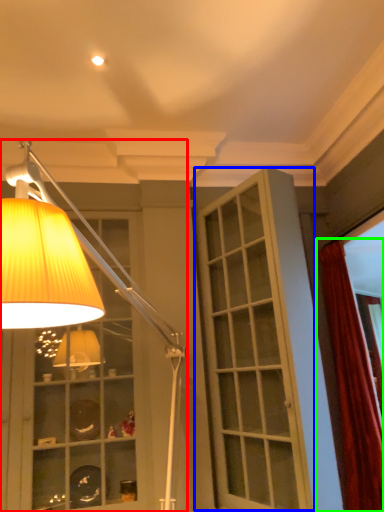
Question: Which object is the farthest from lamp (highlighted by a red box)? Choose among these: screen door (highlighted by a blue box) or curtain (highlighted by a green box).

Choices:
 (A) screen door
 (B) curtain

Answer: (B)